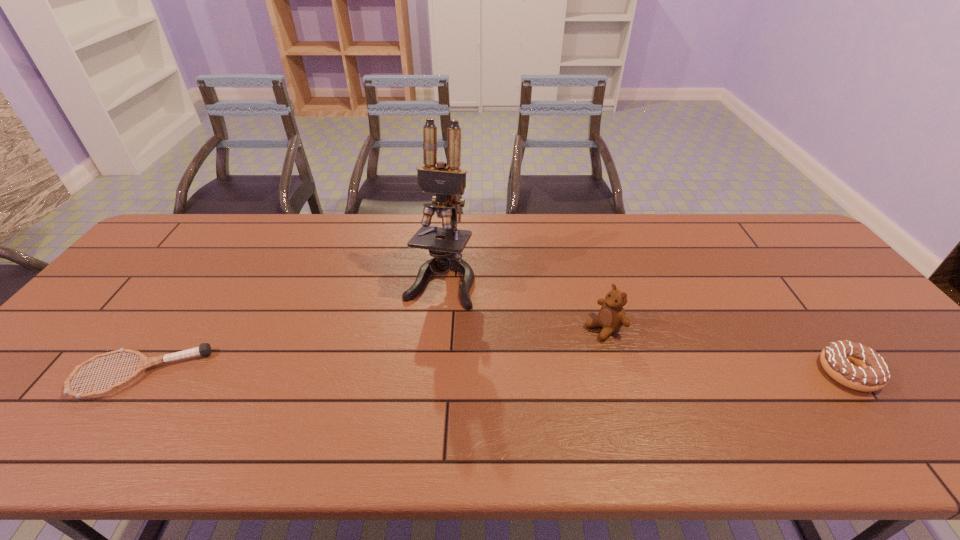
Where is `vacant region located 0.110m at the eyepieces of the farthest object`? This screenshot has height=540, width=960. vacant region located 0.110m at the eyepieces of the farthest object is located at coordinates (419, 340).

The height and width of the screenshot is (540, 960). Identify the location of free spot located 0.110m at the eyepieces of the farthest object. (419, 340).

The image size is (960, 540). In order to click on vacant space located at the eyepieces of the farthest object in this screenshot , I will do `click(405, 375)`.

Locate an element on the screen. vacant space situated 0.300m on the front-facing side of the third shortest object is located at coordinates (492, 388).

This screenshot has height=540, width=960. I want to click on vacant space located on the front-facing side of the third shortest object, so click(x=575, y=343).

You are a GUI agent. You are given a task and a screenshot of the screen. Output one action in this format:
    pyautogui.click(x=<x>, y=<y>)
    Task: Click on the vacant area situated on the front-facing side of the third shortest object
    
    Given the screenshot: What is the action you would take?
    pyautogui.click(x=540, y=362)

The height and width of the screenshot is (540, 960). Identify the location of object present at the far edge. (447, 180).

Find the location of a particular element. This screenshot has height=540, width=960. tennis racket at the near edge is located at coordinates (204, 349).

This screenshot has width=960, height=540. Find the location of `doughnut that is at the near edge`. doughnut that is at the near edge is located at coordinates (854, 365).

Identify the location of object present at the left edge. Image resolution: width=960 pixels, height=540 pixels. (204, 349).